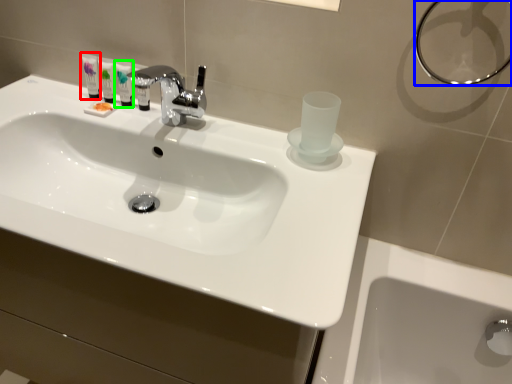
Question: Based on their relative distances, which object is nearer to mouthwash (highlighted by a red box)? Choose from shower (highlighted by a blue box) and mouthwash (highlighted by a green box).

Choices:
 (A) shower
 (B) mouthwash

Answer: (B)